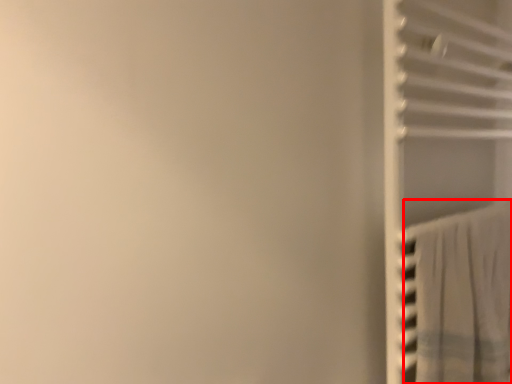
Question: From the image's perspective, where is curtain (annotated by the red box) located relative to closet?

Choices:
 (A) below
 (B) above

Answer: (A)